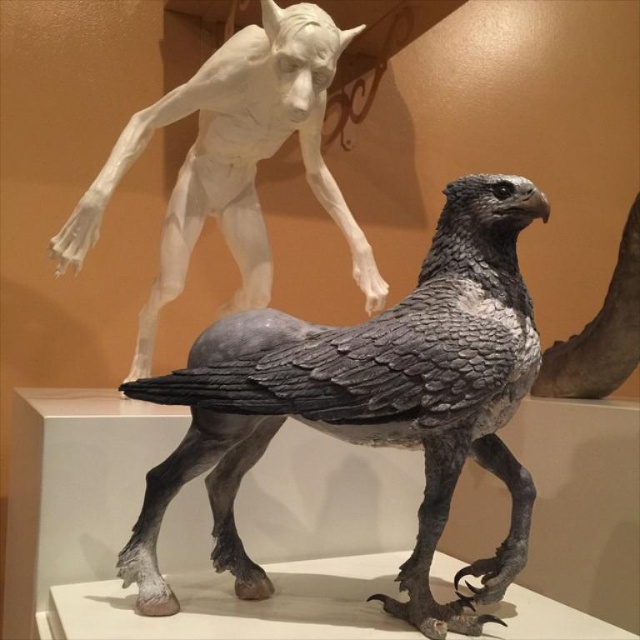
Consider the image. What are the coordinates of the gray textured eagle at center?

The gray textured eagle at center is located at coordinates point (380, 403).

You are an art curator planning to install a protective glass case around both the gray textured eagle at center and the sculpted stone figure at upper left. Given that the glass case must accommodate both sculptures, which sculpture requires a larger space in the case?

The sculpted stone figure at upper left requires a larger space in the glass case because the gray textured eagle at center is smaller than it.